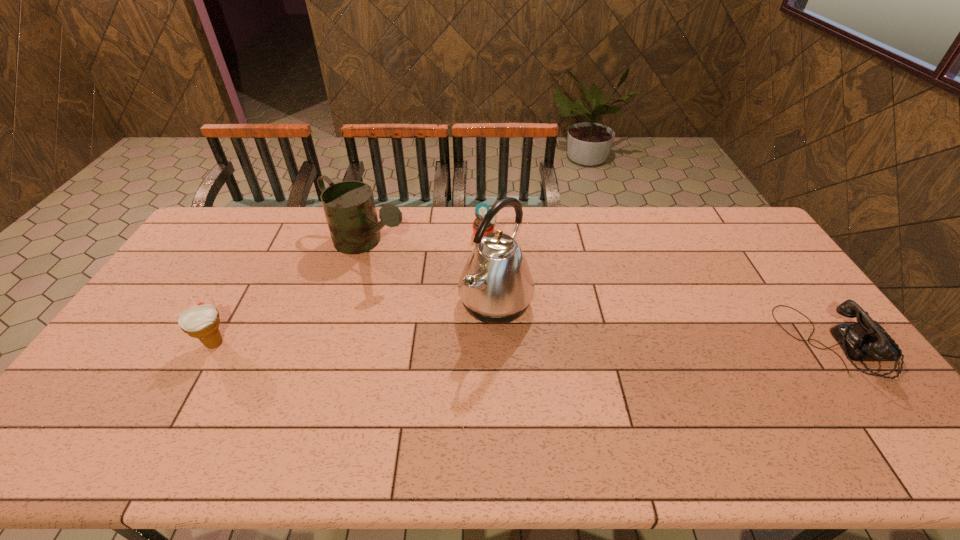
At what (x,y) coordinates should I click in order to perform the action: click on free spot between the rightmost object and the third shortest object. Please return your answer as a coordinate pair (x, y). This screenshot has width=960, height=540. Looking at the image, I should click on (526, 343).

The width and height of the screenshot is (960, 540). Find the location of `blank region between the watering can and the muffin`. blank region between the watering can and the muffin is located at coordinates (425, 240).

The height and width of the screenshot is (540, 960). Find the location of `free space between the fourth object from right to left and the muffin`. free space between the fourth object from right to left and the muffin is located at coordinates (425, 240).

Find the location of a particular element. The image size is (960, 540). object that ranks as the second closest to the muffin is located at coordinates click(349, 206).

Image resolution: width=960 pixels, height=540 pixels. What are the coordinates of `the fourth closest object to the rightmost object` in the screenshot? It's located at (201, 321).

This screenshot has height=540, width=960. In order to click on vacant space that satisfies the following two spatial constraints: 1. on the front side of the rightmost object; 2. on the front-facing side of the muffin in this screenshot , I will do `click(486, 343)`.

Identify the location of vacant space that satisfies the following two spatial constraints: 1. on the back side of the telephone; 2. on the front-facing side of the third shortest object. The image size is (960, 540). (215, 343).

This screenshot has height=540, width=960. In order to click on blank space that satisfies the following two spatial constraints: 1. on the back side of the leftmost object; 2. on the left side of the muffin in this screenshot , I will do `click(276, 234)`.